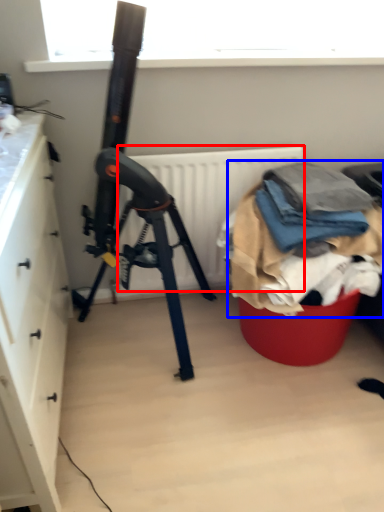
Question: Which of the following is the closest to the observer, radiator (highlighted by a red box) or waste (highlighted by a blue box)?

Choices:
 (A) radiator
 (B) waste

Answer: (B)